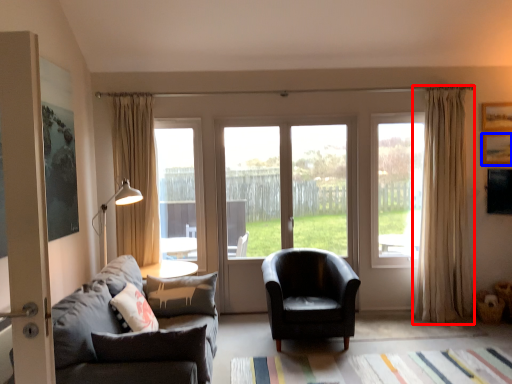
Question: Which object appears farthest to the camera in this image, curtain (highlighted by a red box) or picture frame (highlighted by a blue box)?

Choices:
 (A) curtain
 (B) picture frame

Answer: (B)